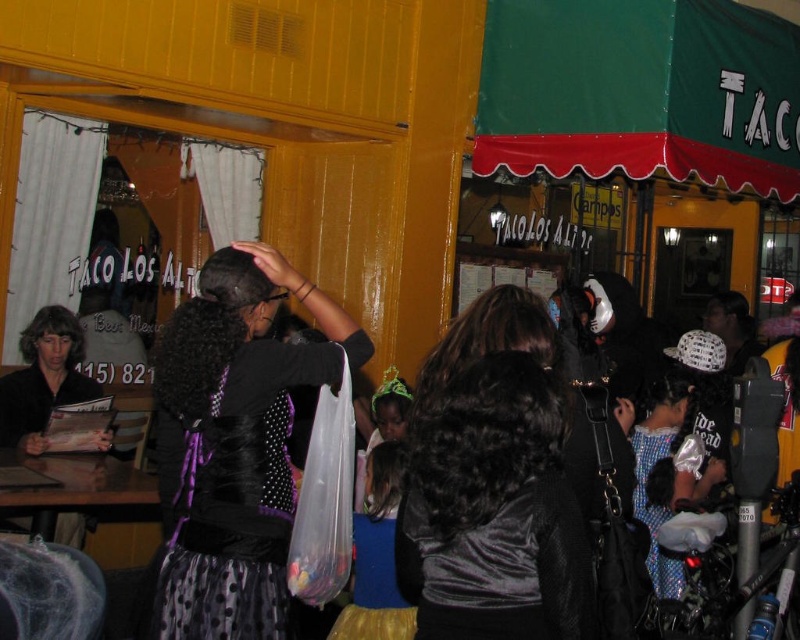
Question: Among these points, which one is farthest from the camera?

Choices:
 (A) (564, 544)
 (B) (348, 346)

Answer: (B)

Question: Is black satin dress at center further to the viewer compared to velvet black shirt at center?

Choices:
 (A) yes
 (B) no

Answer: (A)

Question: Does black satin dress at center have a greater width compared to velvet black shirt at center?

Choices:
 (A) yes
 (B) no

Answer: (A)

Question: Can you confirm if black satin dress at center is wider than velvet black shirt at center?

Choices:
 (A) yes
 (B) no

Answer: (A)